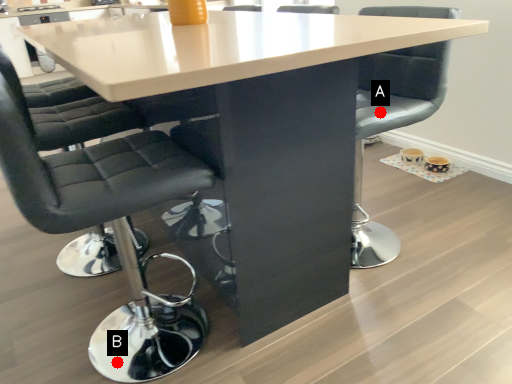
Question: Two points are circled on the image, labeled by A and B beside each circle. Which point appears closest to the camera in this image?

Choices:
 (A) A is closer
 (B) B is closer

Answer: (B)